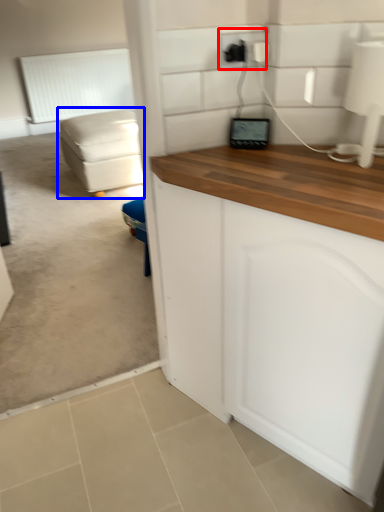
Question: Which point is further to the camera, electric outlet (highlighted by a red box) or studio couch (highlighted by a blue box)?

Choices:
 (A) electric outlet
 (B) studio couch

Answer: (B)